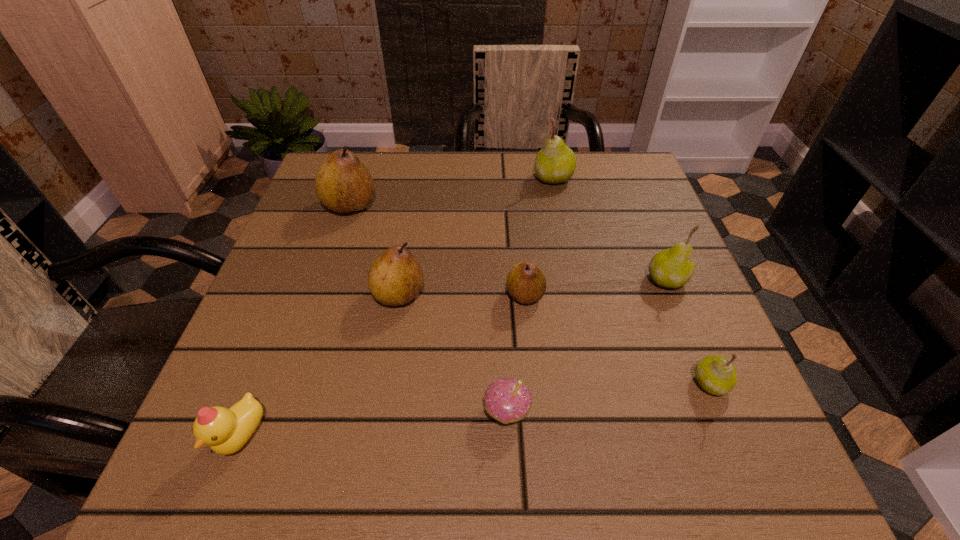
This screenshot has width=960, height=540. Identify the location of cupcake present at the near edge. (507, 400).

Find the location of a particular element. The height and width of the screenshot is (540, 960). duckling that is at the near edge is located at coordinates (226, 431).

The image size is (960, 540). Find the location of `pear located at the left edge`. pear located at the left edge is located at coordinates (343, 184).

Locate an element on the screen. duckling that is positioned at the left edge is located at coordinates (226, 431).

This screenshot has height=540, width=960. I want to click on object at the far left corner, so click(x=343, y=184).

The width and height of the screenshot is (960, 540). Identify the location of object at the near left corner. (226, 431).

Image resolution: width=960 pixels, height=540 pixels. What are the coordinates of `vacant space at the far edge of the desktop` in the screenshot? It's located at (435, 173).

The width and height of the screenshot is (960, 540). In order to click on vacant space at the near edge of the desktop in this screenshot , I will do `click(489, 441)`.

In the image, there is a desktop. Where is `vacant area at the left edge`? Image resolution: width=960 pixels, height=540 pixels. vacant area at the left edge is located at coordinates (300, 405).

I want to click on vacant space at the right edge of the desktop, so coord(664,320).